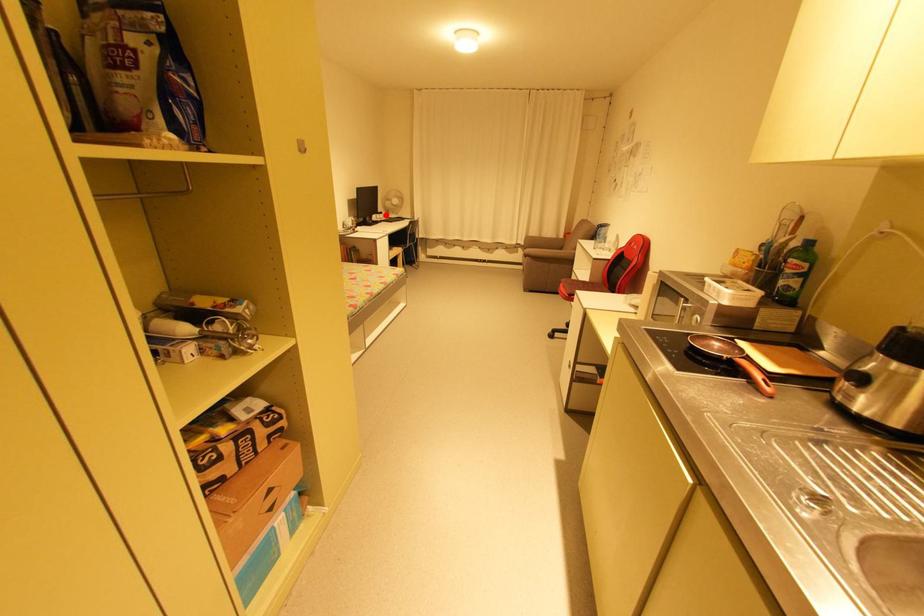
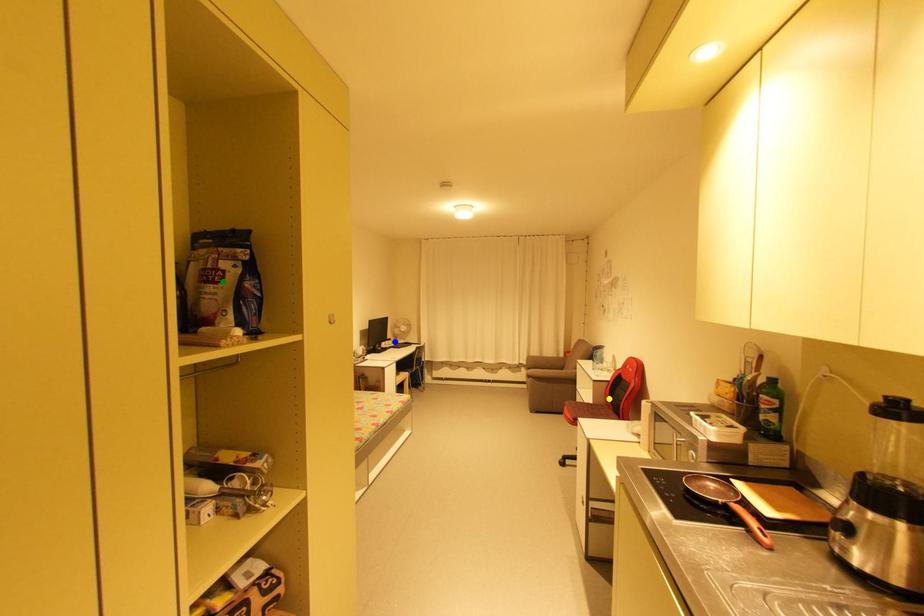
Question: I am providing you with two images of the same scene from different viewpoints. A red point is marked on the first image. You are given multiple points on the second image. Can you choose the point in image 2 that corresponds to the point in image 1?

Choices:
 (A) green point
 (B) yellow point
 (C) blue point

Answer: (C)